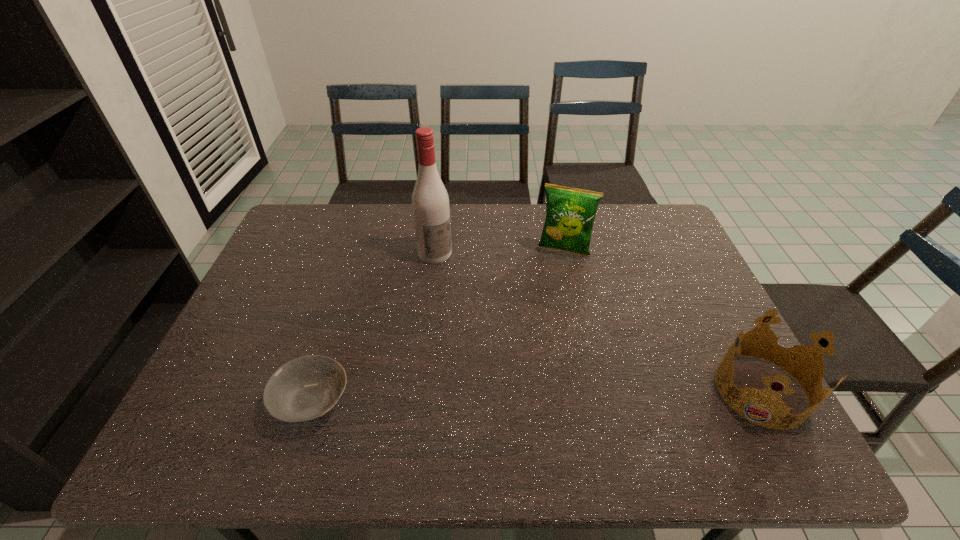
Where is `object that is at the right edge`? Image resolution: width=960 pixels, height=540 pixels. object that is at the right edge is located at coordinates point(810,353).

Find the location of `object that is at the near right corner`. object that is at the near right corner is located at coordinates (810, 353).

Find the location of a particular element. vacant space at the far edge of the desktop is located at coordinates (381, 233).

This screenshot has height=540, width=960. In the image, there is a desktop. In order to click on vacant space at the near edge in this screenshot , I will do (x=414, y=389).

In the image, there is a desktop. At what (x,y) coordinates should I click in order to perform the action: click on vacant space at the left edge. Please return your answer as a coordinate pair (x, y). Looking at the image, I should click on (290, 259).

The height and width of the screenshot is (540, 960). In order to click on free space at the right edge in this screenshot , I will do `click(669, 257)`.

In the image, there is a desktop. Identify the location of vacant region at the far right corner. Image resolution: width=960 pixels, height=540 pixels. (643, 241).

Locate an element on the screen. free space between the alcohol and the rightmost object is located at coordinates (598, 322).

Identify the location of vacant space that is in between the rightmost object and the third object from right to left. Image resolution: width=960 pixels, height=540 pixels. (598, 322).

Image resolution: width=960 pixels, height=540 pixels. Identify the location of free point between the bowl and the rightmost object. (537, 396).